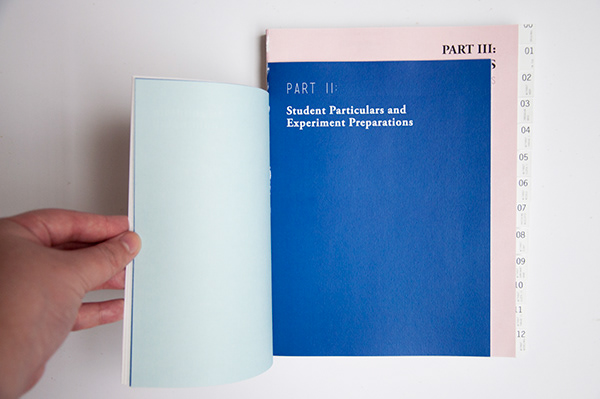
Locate an element on the screen. This screenshot has width=600, height=399. white surface is located at coordinates (84, 36).